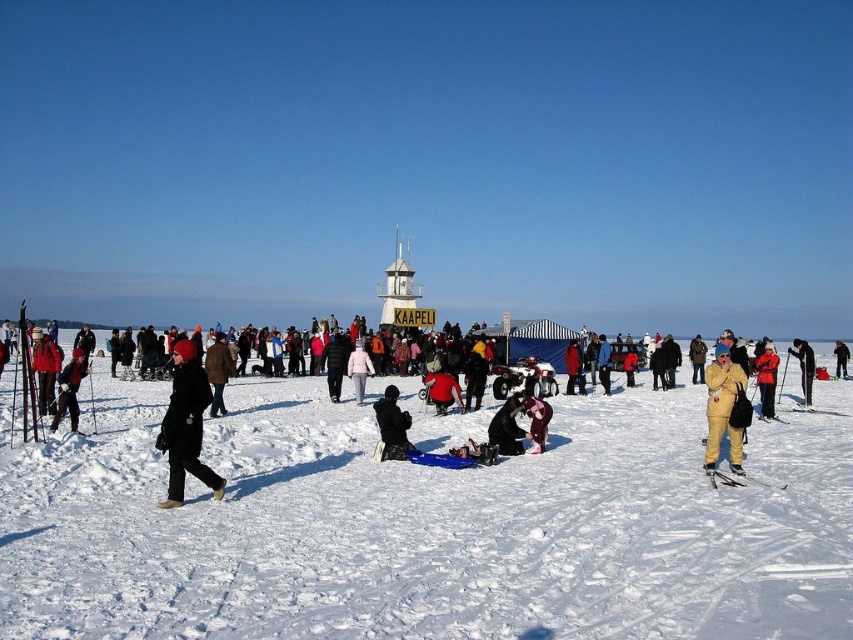
Question: Estimate the real-world distances between objects in this image. Which object is closer to the yellow fabric person at center?

Choices:
 (A) light pink fabric coat at center
 (B) yellow snowsuit at center-right

Answer: (B)

Question: Does matte black coat at center come behind metallic skis at lower right?

Choices:
 (A) yes
 (B) no

Answer: (B)

Question: Can you confirm if yellow matte snowsuit at lower right is positioned to the right of matte yellow ski at lower right?

Choices:
 (A) no
 (B) yes

Answer: (B)

Question: Is light pink fabric coat at center below yellow fabric person at center?

Choices:
 (A) no
 (B) yes

Answer: (B)

Question: Which of these objects is positioned farthest from the matte black ski at left?

Choices:
 (A) light pink fabric coat at center
 (B) matte black coat at center
 (C) yellow snowsuit at right
 (D) black matte jacket at center

Answer: (C)

Question: Which point is farther from the camera taking this photo?

Choices:
 (A) (732, 410)
 (B) (715, 474)
 (C) (57, 396)

Answer: (C)